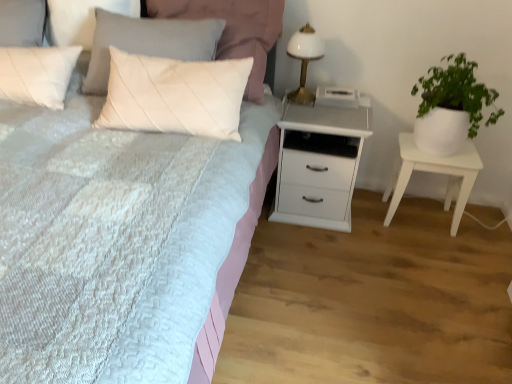
Locate an element on the screen. This screenshot has width=512, height=384. vacant space in front of white matte nightstand at right is located at coordinates pyautogui.click(x=437, y=256).